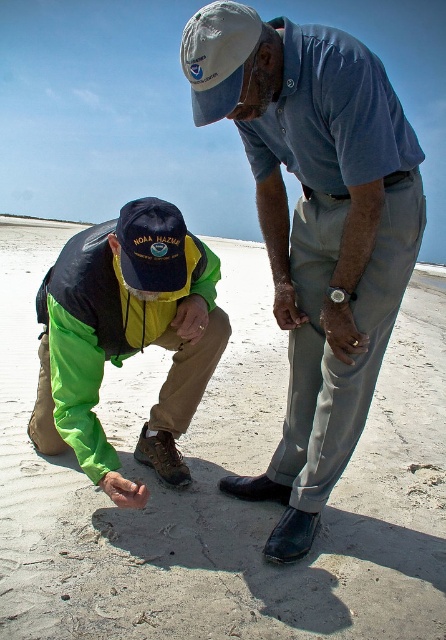
Question: Which point appears closest to the camera in this image?

Choices:
 (A) (322, 240)
 (B) (165, 456)
 (C) (221, 596)

Answer: (C)

Question: Which of the following is the farthest from the observer?

Choices:
 (A) smooth sand at lower center
 (B) green fabric jacket at lower left
 (C) white fabric baseball cap at upper center
 (D) blue cotton shirt at upper center

Answer: (B)

Question: Which object is farther from the camera taking this photo?

Choices:
 (A) green fabric jacket at lower left
 (B) blue cotton shirt at upper center

Answer: (A)

Question: Does smooth sand at lower center lie in front of green fabric jacket at lower left?

Choices:
 (A) no
 (B) yes

Answer: (B)

Question: Is blue cotton shirt at upper center below white fabric baseball cap at upper center?

Choices:
 (A) yes
 (B) no

Answer: (A)

Question: Does smooth sand at lower center appear over green fabric jacket at lower left?

Choices:
 (A) no
 (B) yes

Answer: (B)